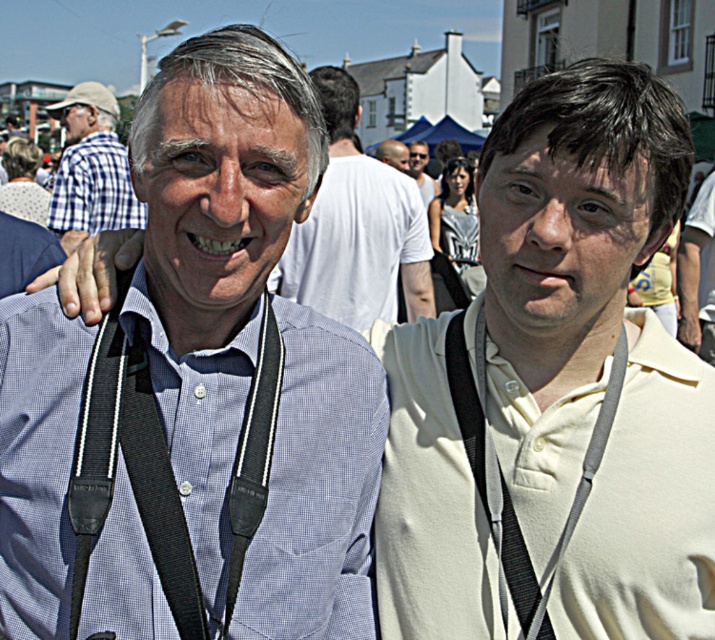
Who is positioned more to the left, black fabric strap at right or white matte shirt at center?

From the viewer's perspective, black fabric strap at right appears more on the left side.

Does black fabric strap at right appear on the left side of white matte shirt at center?

Indeed, black fabric strap at right is positioned on the left side of white matte shirt at center.

Which is behind, point (532, 616) or point (701, 356)?

The point (701, 356) is behind.

This screenshot has width=715, height=640. In order to click on black fabric strap at right in this screenshot , I will do `click(503, 481)`.

Can you confirm if matte blue shirt at center is positioned to the right of matte white sunglasses at center?

No, matte blue shirt at center is not to the right of matte white sunglasses at center.

Does matte blue shirt at center come in front of matte white sunglasses at center?

Yes.

Identify the location of matte blue shirt at center. The image size is (715, 640). (355, 227).

I want to click on matte blue shirt at center, so click(355, 227).

Does point (102, 228) come closer to viewer compared to point (418, 179)?

Yes, point (102, 228) is in front of point (418, 179).

Which is above, checkered fabric shirt at left or matte white sunglasses at center?

Positioned higher is checkered fabric shirt at left.

Does point (77, 209) come closer to viewer compared to point (420, 145)?

That is True.

Where is `checkered fabric shirt at left`? This screenshot has height=640, width=715. checkered fabric shirt at left is located at coordinates (92, 168).